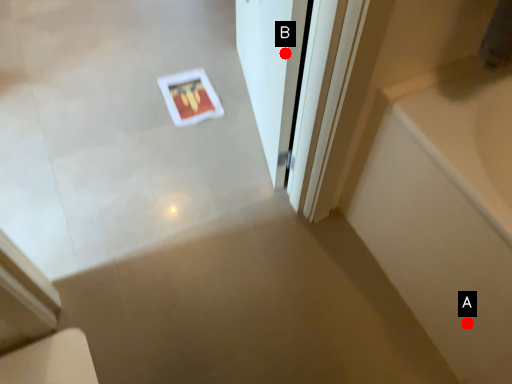
Question: Two points are circled on the image, labeled by A and B beside each circle. Which point appears farthest from the camera in this image?

Choices:
 (A) A is further
 (B) B is further

Answer: (B)